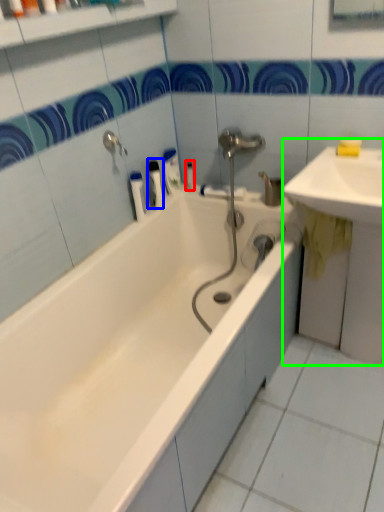
Question: Which object is positioned farthest from toiletry (highlighted by a red box)? Select from toiletry (highlighted by a blue box) and sink (highlighted by a green box).

Choices:
 (A) toiletry
 (B) sink

Answer: (B)